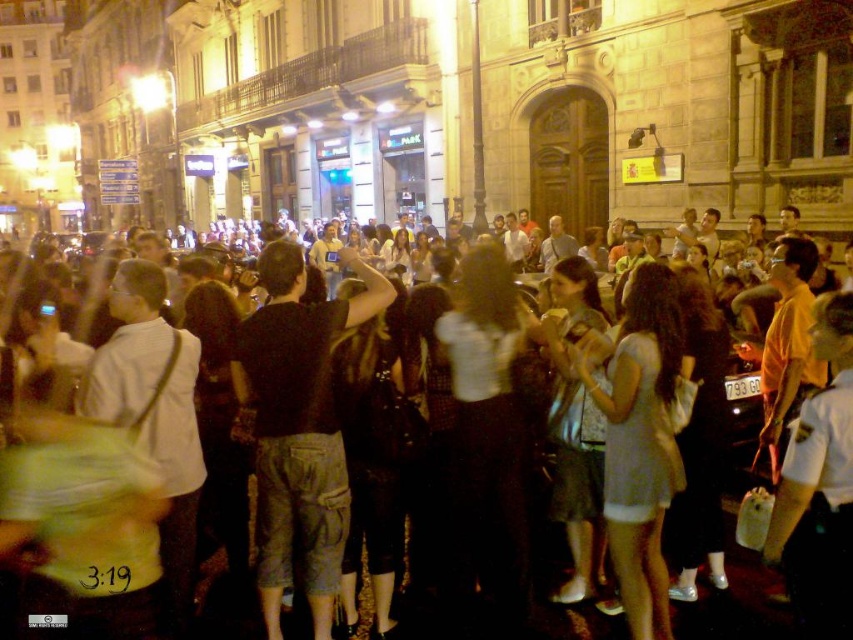
Question: Does black cotton shirt at center have a smaller size compared to dark clothing crowd at center?

Choices:
 (A) no
 (B) yes

Answer: (B)

Question: Among these points, which one is farthest from the camera?

Choices:
 (A) (299, 310)
 (B) (722, 608)

Answer: (A)

Question: Does black cotton shirt at center appear on the left side of dark clothing crowd at center?

Choices:
 (A) yes
 (B) no

Answer: (A)

Question: Which point is closer to the camera taking this photo?

Choices:
 (A) (703, 634)
 (B) (322, 612)

Answer: (A)

Question: Among these objects, which one is farthest from the camera?

Choices:
 (A) dark clothing crowd at center
 (B) black cotton shirt at center

Answer: (B)

Question: From the image, what is the correct spatial relationship of black cotton shirt at center in relation to dark clothing crowd at center?

Choices:
 (A) left
 (B) right

Answer: (A)